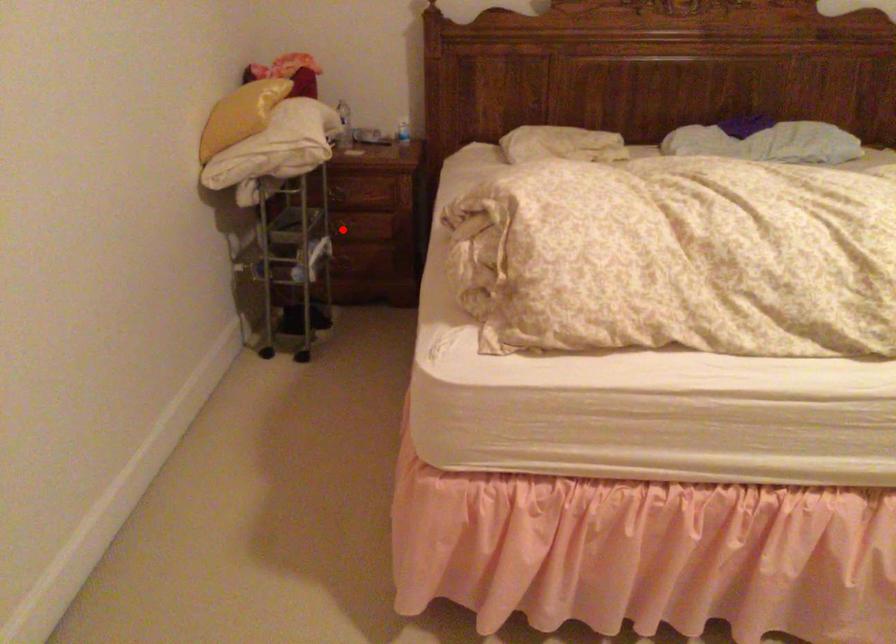
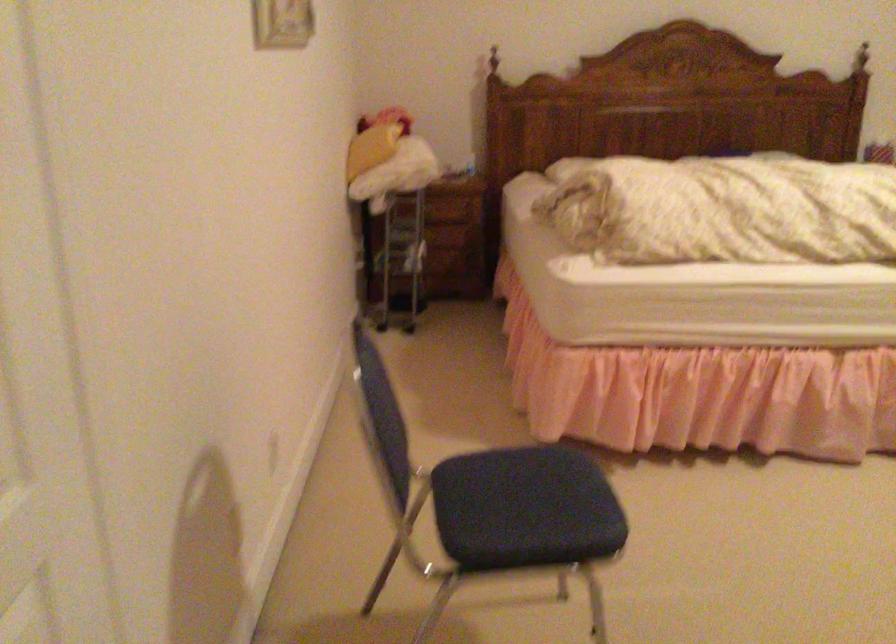
Question: I am providing you with two images of the same scene from different viewpoints. A red point is marked on the first image. Can you still see the location of the red point in image 2?

Choices:
 (A) Yes
 (B) No

Answer: (B)